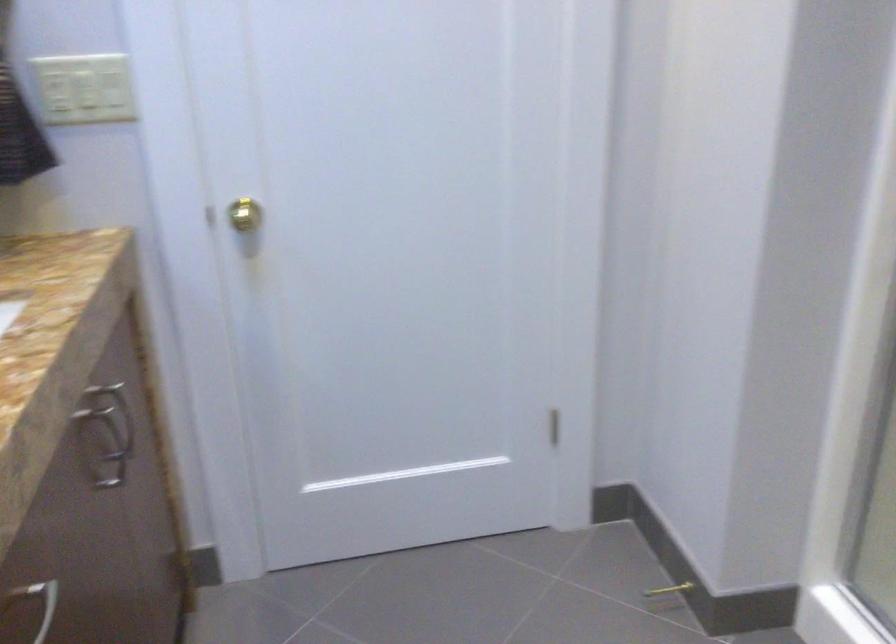
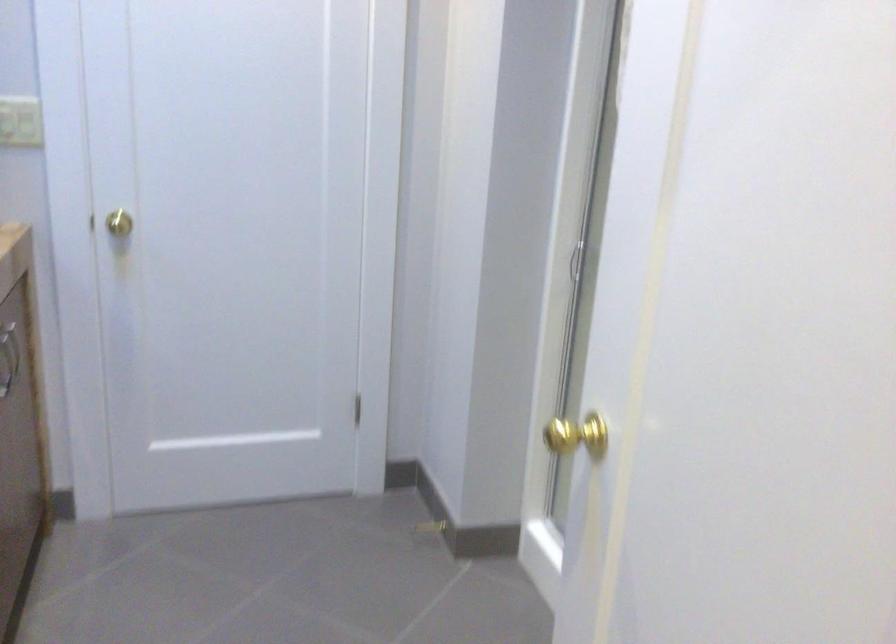
Question: The images are taken continuously from a first-person perspective. In which direction are you moving?

Choices:
 (A) Left
 (B) Right
 (C) Forward
 (D) Backward

Answer: (D)